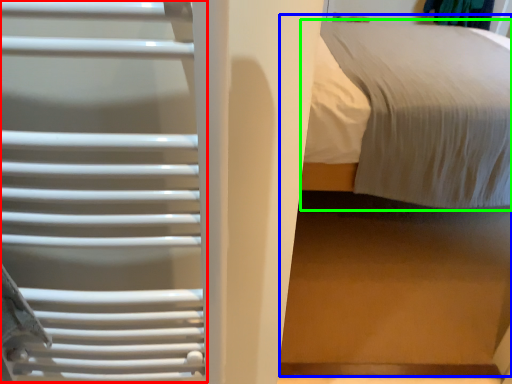
Question: Considering the real-world distances, which object is farthest from cage (highlighted by a red box)? bed (highlighted by a blue box) or bed (highlighted by a green box)?

Choices:
 (A) bed
 (B) bed

Answer: (B)